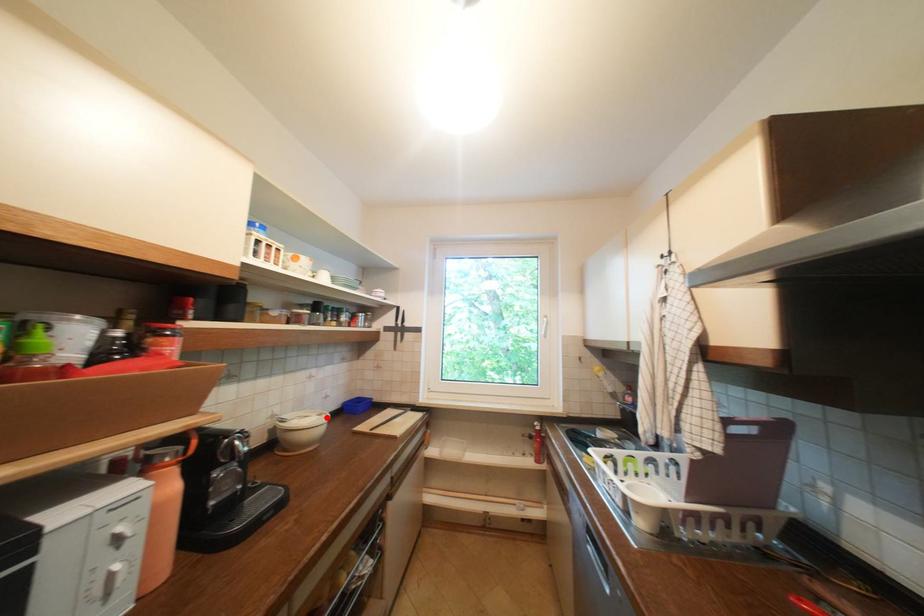
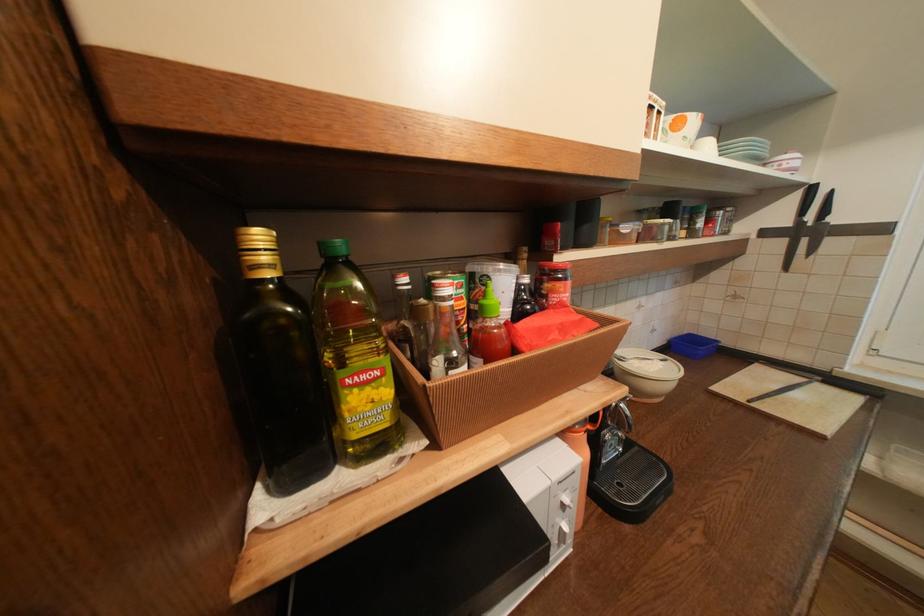
The point at the highlighted location is marked in the first image. Where is the corresponding point in the second image?

(670, 363)